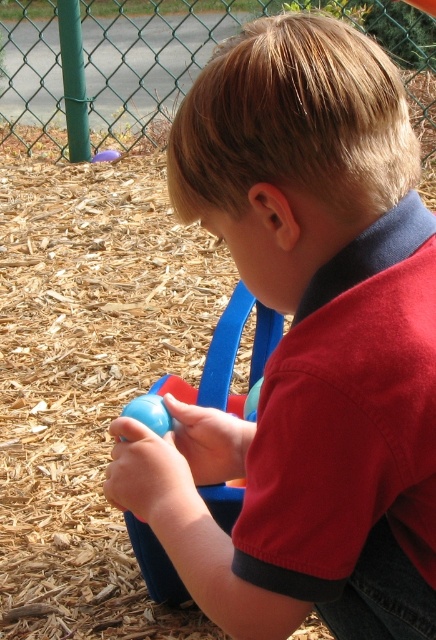
You are standing at the camera position and want to throw a ball to a friend. You have two targets in the playground marked as point (135, 524) and point (95, 160). Which point is closer to you?

Point (135, 524) is closer to the camera than point (95, 160), so you should aim for that point.

You are a parent supervising children at the playground. You see the matte plastic ball at center and the matte blue ball at lower center. Which one is taller?

The matte plastic ball at center is taller than the matte blue ball at lower center according to the description.

You are a parent trying to retrieve a toy for your child. You see the matte plastic ball at center and the matte blue ball at lower center. Which one is closer to you?

The matte plastic ball at center is closer to the viewer than the matte blue ball at lower center.